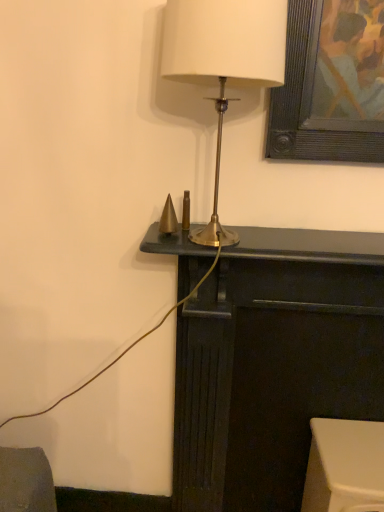
Question: Does white plastic stool at lower right, placed as the 2th furniture when sorted from left to right, have a lesser height compared to dark wood fireplace at center, which ranks as the first furniture in left-to-right order?

Choices:
 (A) yes
 (B) no

Answer: (A)

Question: Considering the relative sizes of white plastic stool at lower right, placed as the 2th furniture when sorted from left to right, and dark wood fireplace at center, which ranks as the first furniture in left-to-right order, in the image provided, is white plastic stool at lower right, placed as the 2th furniture when sorted from left to right, thinner than dark wood fireplace at center, which ranks as the first furniture in left-to-right order,?

Choices:
 (A) yes
 (B) no

Answer: (B)

Question: Can we say white plastic stool at lower right, placed as the 2th furniture when sorted from left to right, lies outside dark wood fireplace at center, the 2th furniture when ordered from right to left?

Choices:
 (A) no
 (B) yes

Answer: (A)

Question: Is white plastic stool at lower right, the 1th furniture from the right, further to camera compared to dark wood fireplace at center, the 2th furniture when ordered from right to left?

Choices:
 (A) yes
 (B) no

Answer: (A)

Question: From a real-world perspective, does white plastic stool at lower right, the 1th furniture from the right, stand above dark wood fireplace at center, which ranks as the first furniture in left-to-right order?

Choices:
 (A) no
 (B) yes

Answer: (A)

Question: From the image's perspective, is matte gold lamp at center above or below dark wood fireplace at center, which ranks as the first furniture in left-to-right order?

Choices:
 (A) above
 (B) below

Answer: (A)

Question: Based on their sizes in the image, would you say matte gold lamp at center is bigger or smaller than dark wood fireplace at center, which ranks as the first furniture in left-to-right order?

Choices:
 (A) big
 (B) small

Answer: (B)

Question: In terms of height, does matte gold lamp at center look taller or shorter compared to dark wood fireplace at center, the 2th furniture when ordered from right to left?

Choices:
 (A) tall
 (B) short

Answer: (B)

Question: Would you say matte gold lamp at center is inside or outside dark wood fireplace at center, which ranks as the first furniture in left-to-right order?

Choices:
 (A) outside
 (B) inside

Answer: (A)

Question: Is matte gold lamp at center taller or shorter than white plastic stool at lower right, placed as the 2th furniture when sorted from left to right?

Choices:
 (A) tall
 (B) short

Answer: (A)

Question: Looking at the image, does matte gold lamp at center seem bigger or smaller compared to white plastic stool at lower right, placed as the 2th furniture when sorted from left to right?

Choices:
 (A) small
 (B) big

Answer: (B)

Question: Is matte gold lamp at center inside the boundaries of white plastic stool at lower right, placed as the 2th furniture when sorted from left to right, or outside?

Choices:
 (A) inside
 (B) outside

Answer: (B)

Question: Is point (226, 27) positioned closer to the camera than point (370, 506)?

Choices:
 (A) closer
 (B) farther

Answer: (A)

Question: Is white plastic stool at lower right, placed as the 2th furniture when sorted from left to right, bigger or smaller than dark wood fireplace at center, the 2th furniture when ordered from right to left?

Choices:
 (A) big
 (B) small

Answer: (B)

Question: In terms of height, does white plastic stool at lower right, the 1th furniture from the right, look taller or shorter compared to dark wood fireplace at center, which ranks as the first furniture in left-to-right order?

Choices:
 (A) short
 (B) tall

Answer: (A)